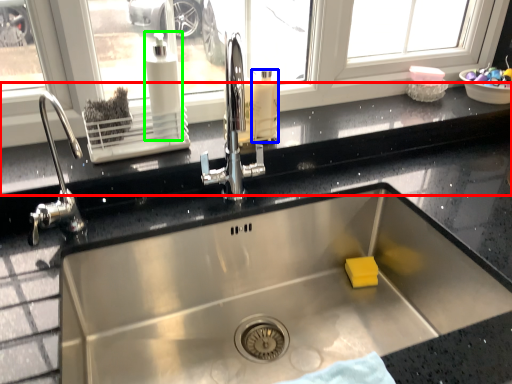
Question: Estimate the real-world distances between objects in this image. Which object is farther from window sill (highlighted by a red box), cleaning product (highlighted by a blue box) or soap dispenser (highlighted by a green box)?

Choices:
 (A) cleaning product
 (B) soap dispenser

Answer: (B)